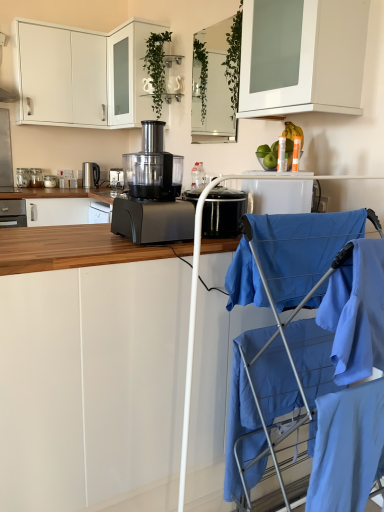
What is the approximate width of green leafy plant at upper center?

green leafy plant at upper center is 9.54 inches wide.

Describe the element at coordinates (116, 178) in the screenshot. I see `black plastic food processor at center, the second home appliance positioned from the left` at that location.

Identify the location of matte black food processor at center, the first kitchen appliance positioned from the left. This screenshot has height=512, width=384. (23, 177).

Based on the photo, what is the approximate height of metallic silver toaster at left, positioned as the 5th kitchen appliance in front-to-back order?

It is 3.86 inches.

The image size is (384, 512). In order to click on white glossy cabinet at upper left, the 1th cabinetry viewed from the top in this screenshot , I will do `click(82, 75)`.

Is point (115, 179) closer to camera compared to point (116, 123)?

No, (115, 179) is behind (116, 123).

Choose the correct answer: Is black plastic food processor at center, marked as the first home appliance in a right-to-left arrangement, inside white glossy cabinet at upper center, the 4th cabinetry positioned from the bottom, or outside it?

black plastic food processor at center, marked as the first home appliance in a right-to-left arrangement, cannot be found inside white glossy cabinet at upper center, the 4th cabinetry positioned from the bottom.

Considering the relative sizes of black plastic food processor at center, marked as the first home appliance in a right-to-left arrangement, and white glossy cabinet at upper center, the 4th cabinetry positioned from the bottom, in the image provided, is black plastic food processor at center, marked as the first home appliance in a right-to-left arrangement, smaller than white glossy cabinet at upper center, the 4th cabinetry positioned from the bottom,?

Yes, black plastic food processor at center, marked as the first home appliance in a right-to-left arrangement, is smaller than white glossy cabinet at upper center, the 4th cabinetry positioned from the bottom.

Are satin silver kettle at left, arranged as the first home appliance when viewed from the left, and matte black food processor at center, arranged as the third kitchen appliance when viewed from the back, far apart?

No.

Is satin silver kettle at left, arranged as the first home appliance when viewed from the left, oriented away from matte black food processor at center, the 5th kitchen appliance when ordered from right to left?

satin silver kettle at left, arranged as the first home appliance when viewed from the left, is not turned away from matte black food processor at center, the 5th kitchen appliance when ordered from right to left.

Between point (90, 165) and point (25, 169), which one is positioned in front?

The point (25, 169) is closer to the camera.

Does satin silver kettle at left, which is counted as the second home appliance, starting from the right, contain matte black food processor at center, the first kitchen appliance positioned from the left?

Definitely not — matte black food processor at center, the first kitchen appliance positioned from the left, is not inside satin silver kettle at left, which is counted as the second home appliance, starting from the right.

Which of these two, blue fabric baby carriage at right or matte black food processor at center, the 5th kitchen appliance when ordered from right to left, is thinner?

matte black food processor at center, the 5th kitchen appliance when ordered from right to left.

Is matte black food processor at center, the 5th kitchen appliance when ordered from right to left, located within blue fabric baby carriage at right?

No, matte black food processor at center, the 5th kitchen appliance when ordered from right to left, is not surrounded by blue fabric baby carriage at right.

Which of these two, blue fabric baby carriage at right or matte black food processor at center, the first kitchen appliance positioned from the left, is bigger?

With larger size is blue fabric baby carriage at right.

Visually, is blue fabric baby carriage at right positioned to the left or to the right of matte black food processor at center, the first kitchen appliance positioned from the left?

From the image, it's evident that blue fabric baby carriage at right is to the right of matte black food processor at center, the first kitchen appliance positioned from the left.

Which point is more distant from viewer, (94,182) or (121,112)?

The point (94,182) is farther from the camera.

Are satin silver kettle at left, which is counted as the second home appliance, starting from the right, and white glossy cabinet at upper left, the fifth cabinetry when ordered from bottom to top, far apart?

No, satin silver kettle at left, which is counted as the second home appliance, starting from the right, is not far away from white glossy cabinet at upper left, the fifth cabinetry when ordered from bottom to top.

How far apart are satin silver kettle at left, which is counted as the second home appliance, starting from the right, and white glossy cabinet at upper left, the 1th cabinetry viewed from the top?

A distance of 30.95 inches exists between satin silver kettle at left, which is counted as the second home appliance, starting from the right, and white glossy cabinet at upper left, the 1th cabinetry viewed from the top.

From a real-world perspective, is satin silver kettle at left, arranged as the first home appliance when viewed from the left, under metallic silver toaster at left, placed as the third kitchen appliance when sorted from right to left?

Incorrect, from a real-world perspective, satin silver kettle at left, arranged as the first home appliance when viewed from the left, is higher than metallic silver toaster at left, placed as the third kitchen appliance when sorted from right to left.

You are a GUI agent. You are given a task and a screenshot of the screen. Output one action in this format:
    pyautogui.click(x=<x>, y=<y>)
    Task: Click on the kitchen appliance that is the 4th object directly below the satin silver kettle at left, arranged as the first home appliance when viewed from the left (from a real-world perspective)
    The image size is (384, 512).
    Given the screenshot: What is the action you would take?
    pyautogui.click(x=50, y=181)

Based on the photo, from the image's perspective, is satin silver kettle at left, arranged as the first home appliance when viewed from the left, on top of metallic silver toaster at left, positioned as the 1th kitchen appliance in back-to-front order?

Yes, from the image's perspective, satin silver kettle at left, arranged as the first home appliance when viewed from the left, is on top of metallic silver toaster at left, positioned as the 1th kitchen appliance in back-to-front order.

Relative to metallic silver toaster at left, placed as the third kitchen appliance when sorted from right to left, is satin silver kettle at left, arranged as the first home appliance when viewed from the left, in front or behind?

Clearly, satin silver kettle at left, arranged as the first home appliance when viewed from the left, is in front of metallic silver toaster at left, placed as the third kitchen appliance when sorted from right to left.

Which object is positioned more to the left, light blue fabric at lower right or white matte cabinet at center, marked as the first cabinetry in a bottom-to-top arrangement?

Positioned to the left is white matte cabinet at center, marked as the first cabinetry in a bottom-to-top arrangement.

Which object is more forward, light blue fabric at lower right or white matte cabinet at center, which appears as the fifth cabinetry when viewed from the top?

light blue fabric at lower right.

Is light blue fabric at lower right facing towards white matte cabinet at center, which appears as the fifth cabinetry when viewed from the top?

No, light blue fabric at lower right is not facing towards white matte cabinet at center, which appears as the fifth cabinetry when viewed from the top.

You are a GUI agent. You are given a task and a screenshot of the screen. Output one action in this format:
    pyautogui.click(x=<x>, y=<y>)
    Task: Click on the kitchen appliance that is the 3rd object located below the satin silver kettle at left, which is counted as the second home appliance, starting from the right (from the image's perspective)
    
    Given the screenshot: What is the action you would take?
    pyautogui.click(x=50, y=181)

Is metallic silver toaster at left, positioned as the 5th kitchen appliance in front-to-back order, wider than satin silver kettle at left, arranged as the first home appliance when viewed from the left?

In fact, metallic silver toaster at left, positioned as the 5th kitchen appliance in front-to-back order, might be narrower than satin silver kettle at left, arranged as the first home appliance when viewed from the left.

Consider the image. Who is bigger, metallic silver toaster at left, positioned as the 1th kitchen appliance in back-to-front order, or satin silver kettle at left, which is counted as the second home appliance, starting from the right?

Bigger between the two is satin silver kettle at left, which is counted as the second home appliance, starting from the right.

Is metallic silver toaster at left, positioned as the 5th kitchen appliance in front-to-back order, positioned in front of satin silver kettle at left, arranged as the first home appliance when viewed from the left?

No, metallic silver toaster at left, positioned as the 5th kitchen appliance in front-to-back order, is further to the viewer.

Identify the location of the 3rd cabinetry located above the black plastic food processor at center, the second home appliance positioned from the left (from a real-world perspective). The width and height of the screenshot is (384, 512). (129, 74).

At what (x,y) coordinates should I click in order to perform the action: click on kitchen appliance that is the 2nd one when counting downward from the satin silver kettle at left, which is counted as the second home appliance, starting from the right (from the image's perspective). Please return your answer as a coordinate pair (x, y). The image size is (384, 512). Looking at the image, I should click on (23, 177).

When comparing their distances from black plastic food processor at center, positioned as the 5th kitchen appliance in back-to-front order, does light blue fabric at lower right or clear glass mirror at upper center, the third cabinetry from the bottom, seem closer?

Among the two, light blue fabric at lower right is located nearer to black plastic food processor at center, positioned as the 5th kitchen appliance in back-to-front order.

When comparing their distances from white glossy cabinet at upper center, marked as the second cabinetry in a top-to-bottom arrangement, does white matte cabinet at upper center, the 2th cabinetry from the bottom, or black plastic food processor at center, the second home appliance positioned from the left, seem closer?

Among the two, black plastic food processor at center, the second home appliance positioned from the left, is located nearer to white glossy cabinet at upper center, marked as the second cabinetry in a top-to-bottom arrangement.

Considering their positions, is white glossy cabinet at upper center, marked as the second cabinetry in a top-to-bottom arrangement, positioned closer to blue fabric baby carriage at right than light blue fabric at lower right?

light blue fabric at lower right is positioned closer to the anchor blue fabric baby carriage at right.

Looking at the image, which one is located further to metallic silver toaster at left, positioned as the 1th kitchen appliance in back-to-front order, white glossy cabinet at upper center, the 4th cabinetry positioned from the bottom, or blue fabric baby carriage at right?

blue fabric baby carriage at right lies further to metallic silver toaster at left, positioned as the 1th kitchen appliance in back-to-front order, than the other object.

Considering their positions, is light blue fabric at lower right positioned further to white glossy cabinet at upper left, the 1th cabinetry viewed from the top, than clear glass mirror at upper center, which ranks as the third cabinetry in top-to-bottom order?

Based on the image, light blue fabric at lower right appears to be further to white glossy cabinet at upper left, the 1th cabinetry viewed from the top.

Which object lies nearer to the anchor point clear glass jar at left, the second kitchen appliance when ordered from back to front, metallic silver toaster at left, placed as the third kitchen appliance when sorted from right to left, or clear glass mirror at upper center, the third cabinetry from the bottom?

metallic silver toaster at left, placed as the third kitchen appliance when sorted from right to left.

Based on their spatial positions, is white glossy cabinet at upper center, the 4th cabinetry positioned from the bottom, or green leafy plant at upper center closer to blue fabric baby carriage at right?

green leafy plant at upper center.

From the image, which object appears to be nearer to black plastic food processor at center, the first kitchen appliance from the front, green leafy plant at upper center or satin silver kettle at left, arranged as the first home appliance when viewed from the left?

Among the two, green leafy plant at upper center is located nearer to black plastic food processor at center, the first kitchen appliance from the front.

At what (x,y) coordinates should I click in order to perform the action: click on plant that lies between white glossy cabinet at upper left, the 1th cabinetry viewed from the top, and light blue fabric at lower right from top to bottom. Please return your answer as a coordinate pair (x, y). This screenshot has height=512, width=384. Looking at the image, I should click on (156, 67).

Identify the location of home appliance between blue fabric baby carriage at right and metallic silver toaster at left, the third kitchen appliance when ordered from left to right, in the front-back direction. Image resolution: width=384 pixels, height=512 pixels. (90, 174).

Identify the location of robe between blue fabric baby carriage at right and matte black food processor at center, arranged as the third kitchen appliance when viewed from the back, from front to back. (347, 448).

The image size is (384, 512). What are the coordinates of `robe positioned between blue fabric baby carriage at right and clear glass jar at left, which appears as the 4th kitchen appliance when viewed from the right, from near to far` in the screenshot? It's located at (347, 448).